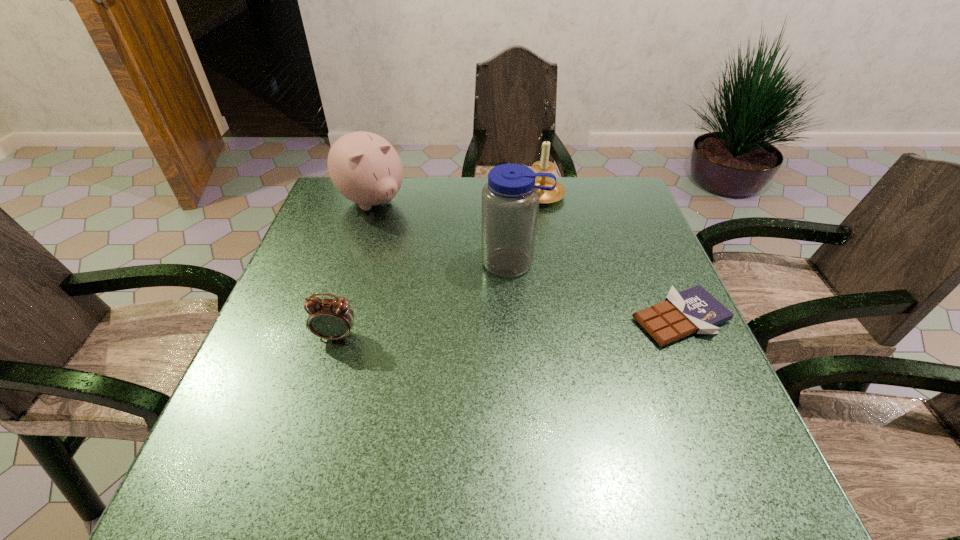
Identify the location of alarm clock. The height and width of the screenshot is (540, 960). (332, 319).

You are a GUI agent. You are given a task and a screenshot of the screen. Output one action in this format:
    pyautogui.click(x=<x>, y=<y>)
    Task: Click on the chocolate bar
    The width and height of the screenshot is (960, 540).
    Given the screenshot: What is the action you would take?
    pyautogui.click(x=694, y=310)

I want to click on the shortest object, so click(694, 310).

At what (x,y) coordinates should I click in order to perform the action: click on piggy bank. Please return your answer as a coordinate pair (x, y). Looking at the image, I should click on (365, 168).

Locate an element on the screen. Image resolution: width=960 pixels, height=540 pixels. candle holder is located at coordinates (544, 165).

This screenshot has width=960, height=540. What are the coordinates of `water bottle` in the screenshot? It's located at (510, 199).

Identify the location of the third nearest object. This screenshot has width=960, height=540. (510, 199).

The width and height of the screenshot is (960, 540). Identify the location of free space located 0.120m on the face of the alarm clock. (319, 394).

Where is `free region located 0.260m on the back of the shortest object`? free region located 0.260m on the back of the shortest object is located at coordinates (639, 225).

Where is `vacant space located at the snout of the piggy bank`? This screenshot has height=540, width=960. vacant space located at the snout of the piggy bank is located at coordinates (459, 287).